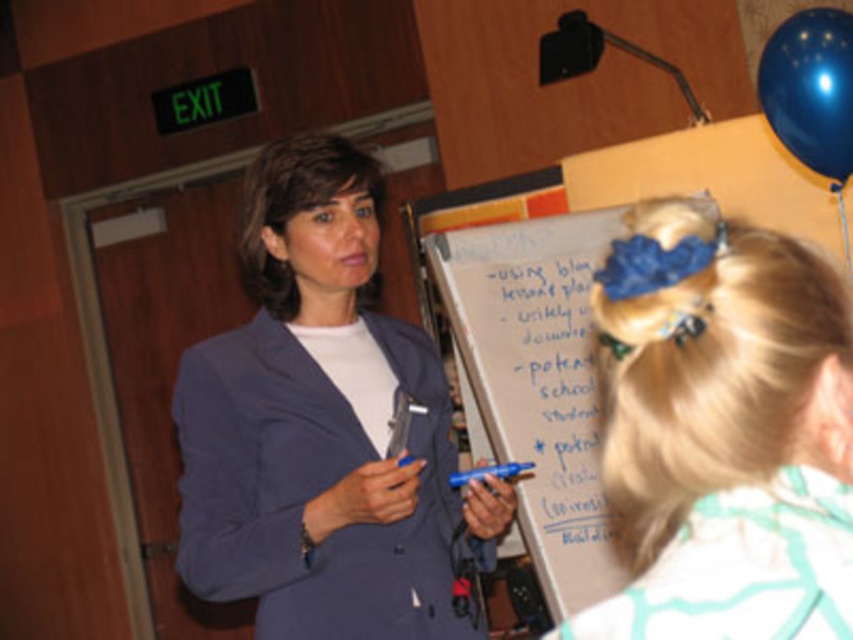
Question: Which point appears farthest from the camera in this image?

Choices:
 (A) (781, 81)
 (B) (611, 605)

Answer: (A)

Question: Can you confirm if white chalkboard at center is smaller than blue rubber balloon at upper right?

Choices:
 (A) yes
 (B) no

Answer: (B)

Question: Is matte blue blazer at center further to camera compared to white chalkboard at center?

Choices:
 (A) yes
 (B) no

Answer: (B)

Question: Can you confirm if white matte hair at upper center is positioned to the right of whiteboard at center?

Choices:
 (A) no
 (B) yes

Answer: (A)

Question: Which point is farther from the camera taking this photo?

Choices:
 (A) (294, 484)
 (B) (556, 392)

Answer: (B)

Question: Which object appears closest to the camera in this image?

Choices:
 (A) matte blue blazer at center
 (B) whiteboard at center
 (C) white matte hair at upper center

Answer: (C)